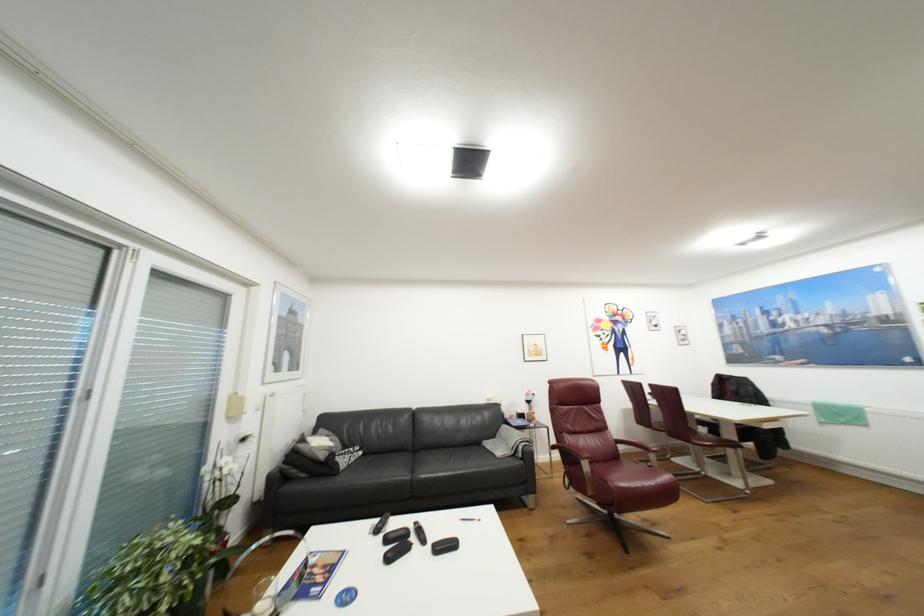
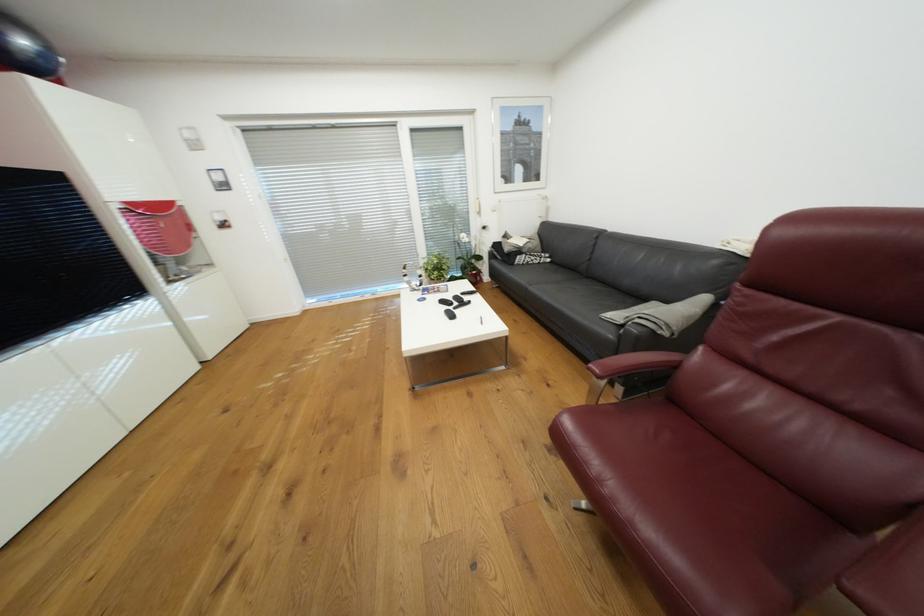
In the second image, find the point that corresponds to [339,454] in the first image.

(526, 252)